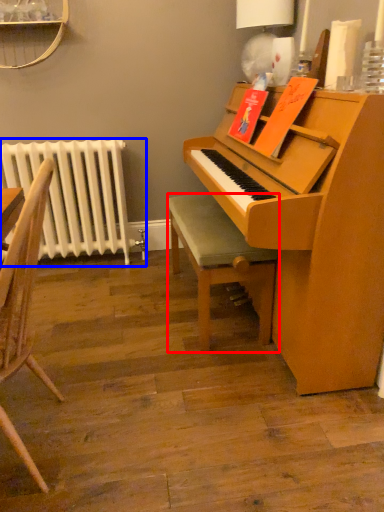
Question: Which point is further to the camera, stool (highlighted by a red box) or radiator (highlighted by a blue box)?

Choices:
 (A) stool
 (B) radiator

Answer: (B)